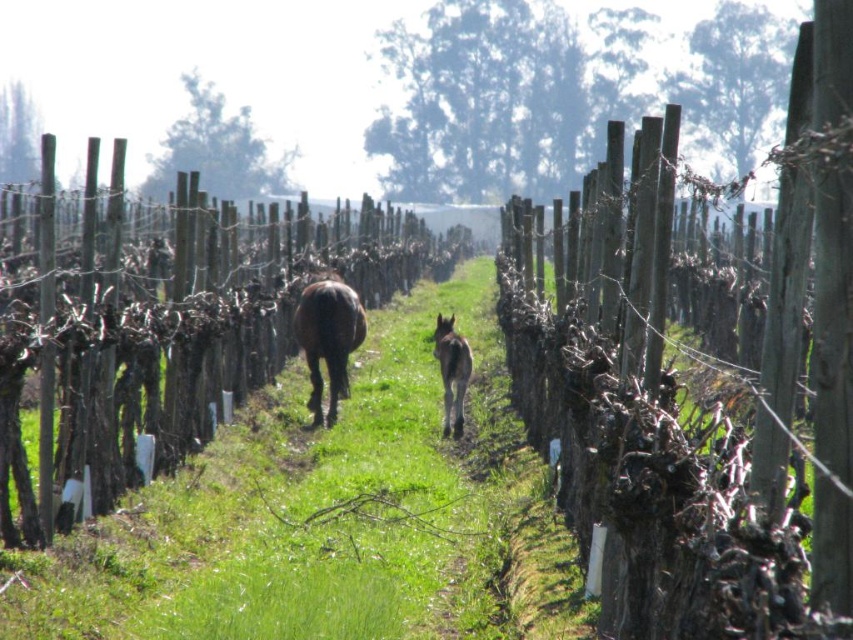
You are a farmer checking the fence line. You notice the wooden fence at center and the brown glossy horse at center. Which one is taller?

The wooden fence at center is taller than the brown glossy horse at center.

You are a farmer checking the fence line. You notice the wooden fence at center and the green grass at center. Which one is higher in the scene?

The wooden fence at center is above green grass at center, so the wooden fence at center is higher in the scene.